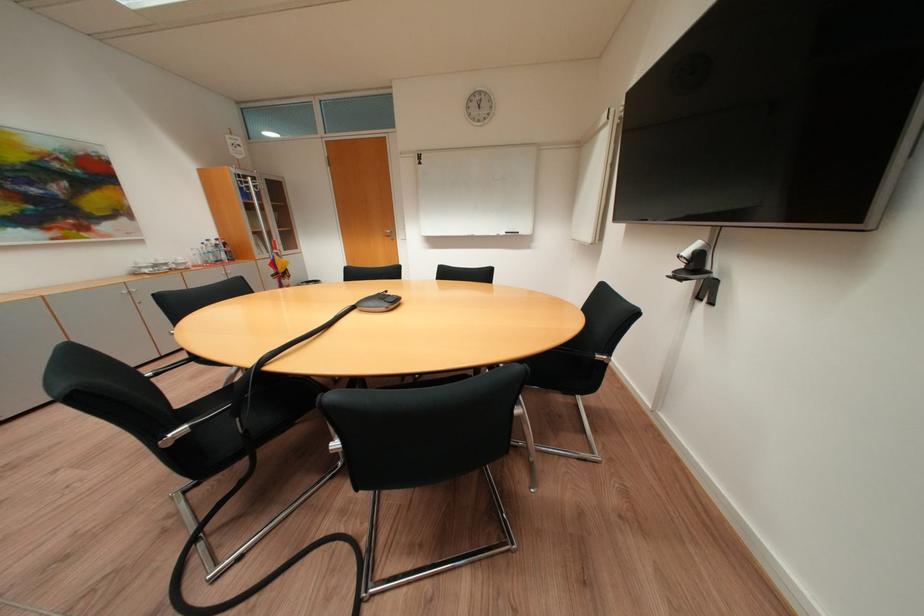
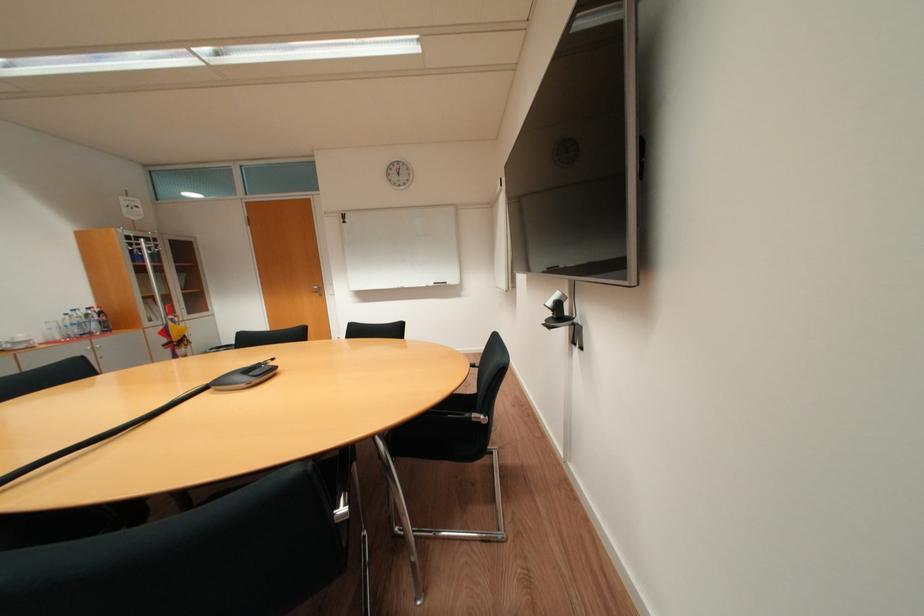
The point at (223, 243) is marked in the first image. Where is the corresponding point in the second image?

(92, 313)